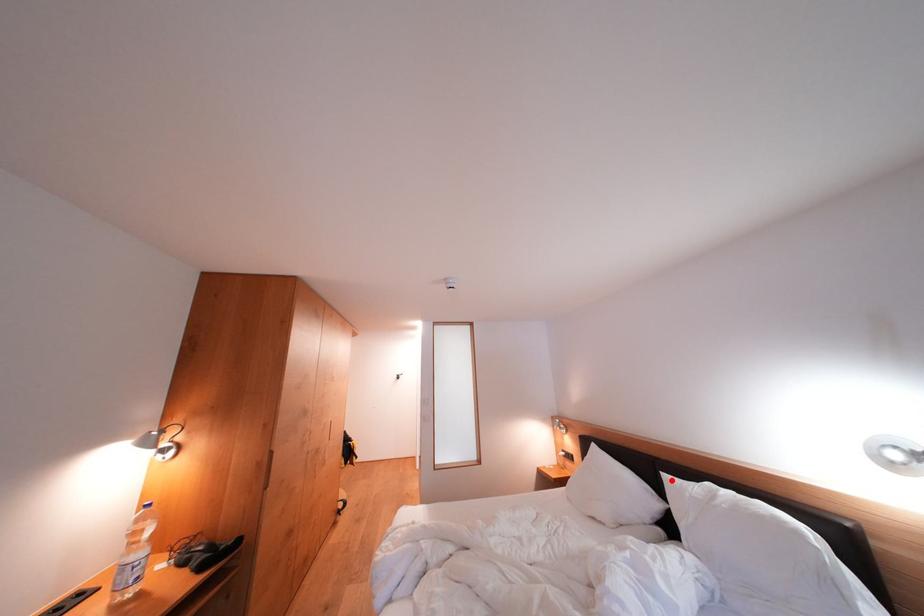
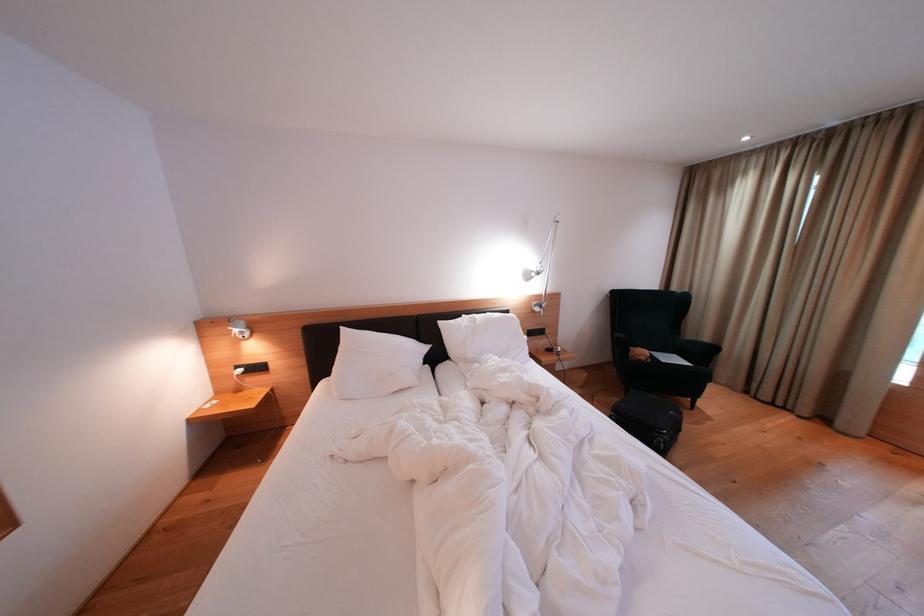
The point at the highlighted location is marked in the first image. Where is the corresponding point in the second image?

(447, 328)